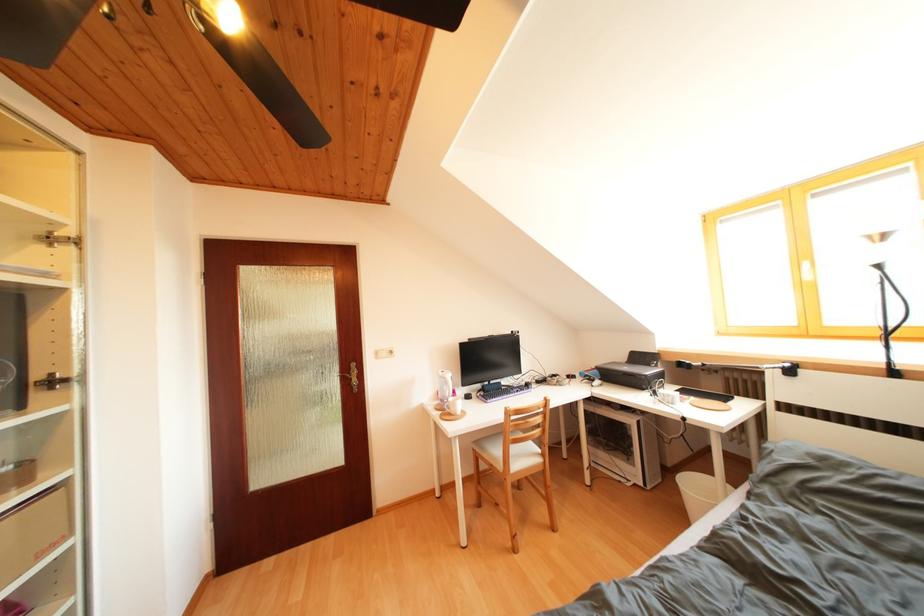
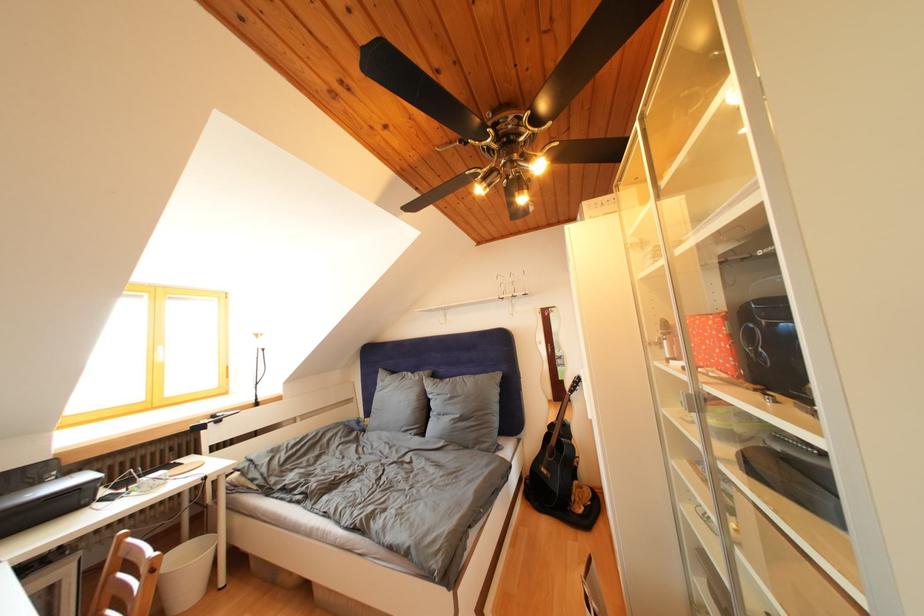
Locate, in the second image, the point that corresponds to pixel 655 370 in the first image.

(44, 488)